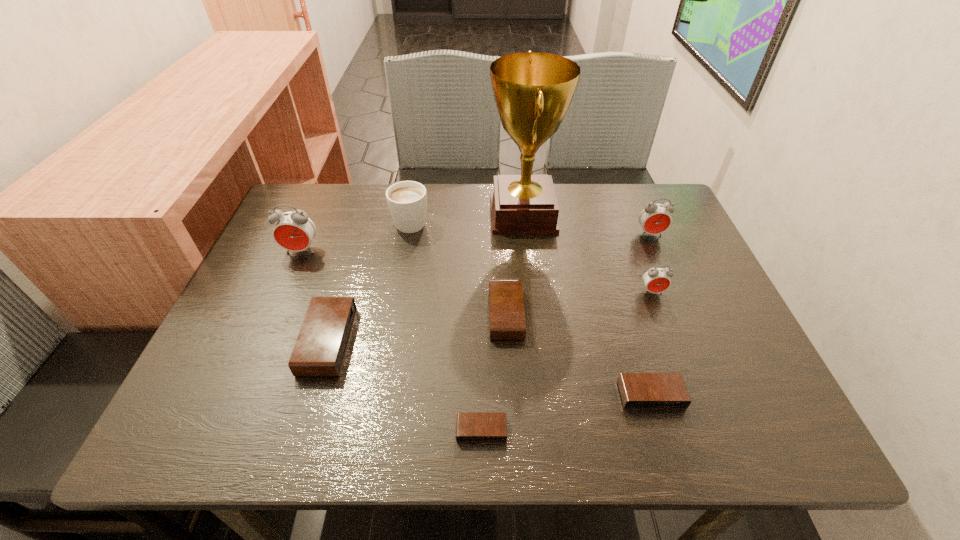
Image resolution: width=960 pixels, height=540 pixels. I want to click on object that stands as the third closest to the cappuccino, so click(506, 306).

Find the location of a particular element. object that is the closest to the farthest alarm clock is located at coordinates (656, 280).

This screenshot has height=540, width=960. I want to click on alarm clock that stands as the third closest to the cappuccino, so click(320, 348).

Find the location of `alarm clock that is the sixth closest to the nearest object`. alarm clock that is the sixth closest to the nearest object is located at coordinates (654, 218).

Identify which red alarm clock is the second nearest to the third shortest object. Please provide its 2D coordinates. Your answer should be formatted as a tuple, i.e. [(x, y)], where the tuple contains the x and y coordinates of a point satisfying the conditions above.

[(654, 218)]

At what (x,y) coordinates should I click in order to perform the action: click on red alarm clock that stands as the second closest to the nearest object. Please return your answer as a coordinate pair (x, y). Looking at the image, I should click on (294, 231).

Identify which black alarm clock is located as the nearest to the second nearest black alarm clock. Please provide its 2D coordinates. Your answer should be formatted as a tuple, i.e. [(x, y)], where the tuple contains the x and y coordinates of a point satisfying the conditions above.

[(506, 306)]

Identify which black alarm clock is the second closest to the second object from left to right. Please provide its 2D coordinates. Your answer should be formatted as a tuple, i.e. [(x, y)], where the tuple contains the x and y coordinates of a point satisfying the conditions above.

[(506, 306)]

Locate an element on the screen. vacant space that satisfies the following two spatial constraints: 1. on the plaque of the award; 2. on the face of the biggest red alarm clock is located at coordinates (527, 251).

Find the location of `vacant region that satisfies the following two spatial constraints: 1. on the face of the nearest red alarm clock; 2. on the front face of the seventh tallest object`. vacant region that satisfies the following two spatial constraints: 1. on the face of the nearest red alarm clock; 2. on the front face of the seventh tallest object is located at coordinates (660, 314).